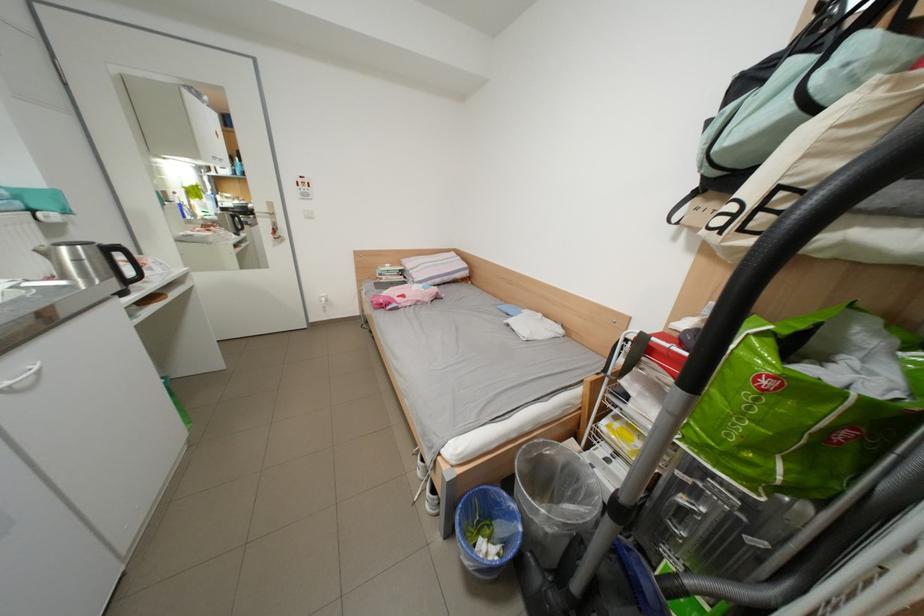
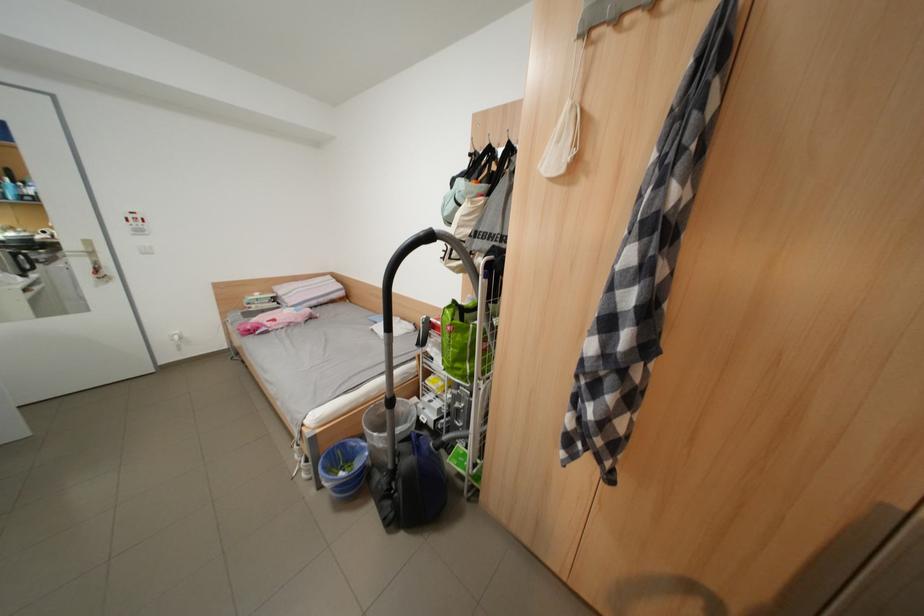
Where in the second image is the point corresponding to the point at 317,197 from the first image?

(152, 233)